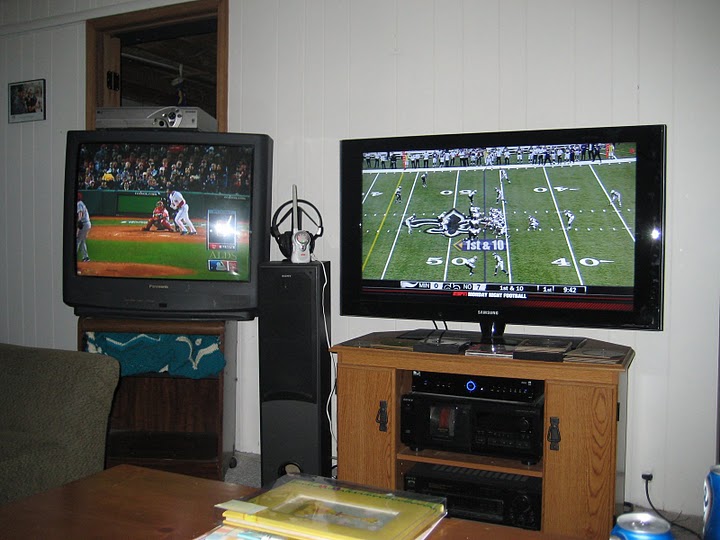
Where is `doors`? The image size is (720, 540). doors is located at coordinates (572, 489), (369, 447).